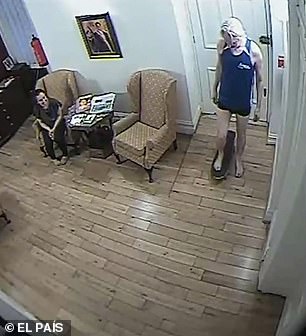
Where is `top drawer`? The height and width of the screenshot is (336, 306). top drawer is located at coordinates coord(3,96).